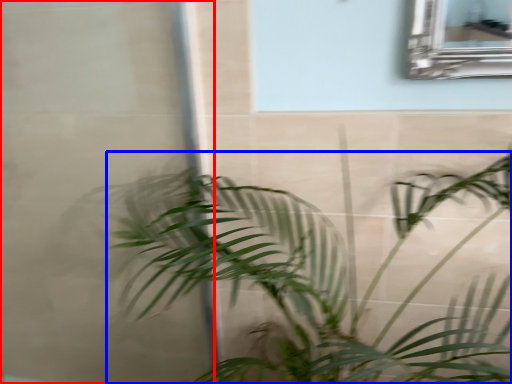
Question: Which object is closer to the camera taking this photo, glass door (highlighted by a red box) or houseplant (highlighted by a blue box)?

Choices:
 (A) glass door
 (B) houseplant

Answer: (B)